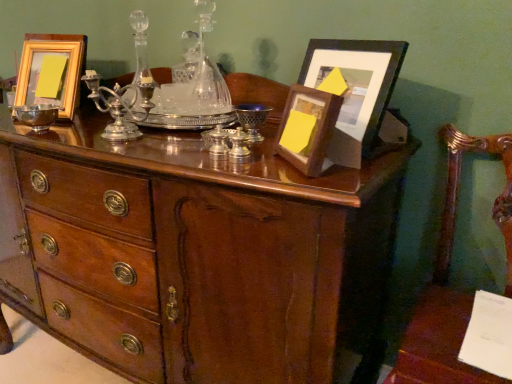
The image size is (512, 384). Find the location of `free spot in front of shiny silver candle holder at center, which is counted as the 1th candle holder, starting from the right`. free spot in front of shiny silver candle holder at center, which is counted as the 1th candle holder, starting from the right is located at coordinates (252, 177).